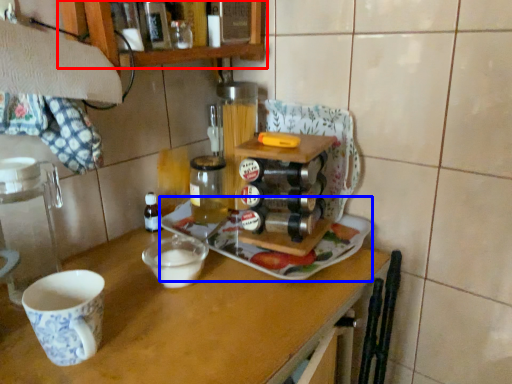
Question: Among these objects, which one is nearest to the camera, cabinetry (highlighted by a red box) or tray (highlighted by a blue box)?

Choices:
 (A) cabinetry
 (B) tray

Answer: (A)